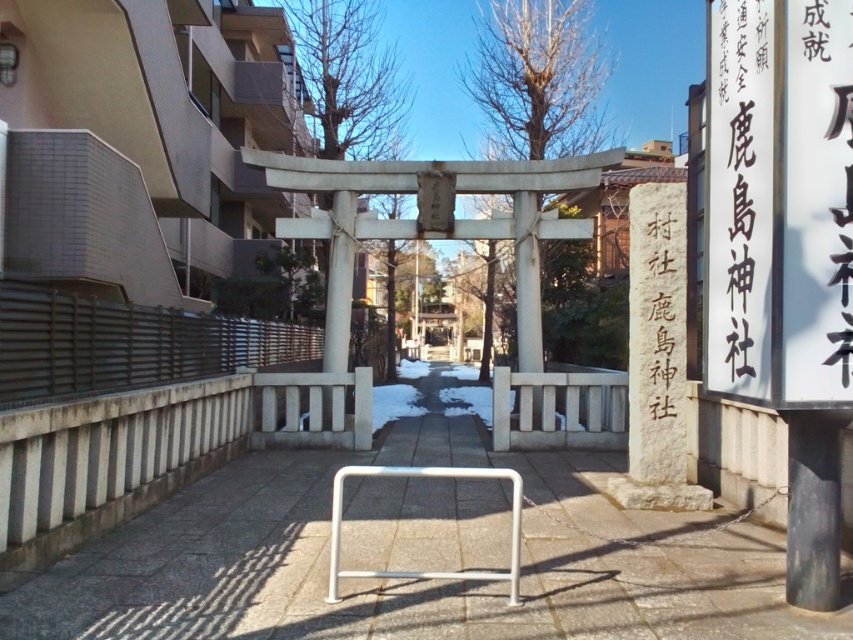
Which is more to the left, black stone sign at center right or white metallic bar at center?

Positioned to the left is white metallic bar at center.

In the scene shown: Is black stone sign at center right above white metallic bar at center?

Yes.

Locate an element on the screen. black stone sign at center right is located at coordinates (662, 316).

Which is below, gray concrete pavement at center or white metallic bar at center?

white metallic bar at center is below.

Which of these two, gray concrete pavement at center or white metallic bar at center, stands taller?

With more height is white metallic bar at center.

Is point (637, 572) positioned behind point (363, 576)?

Yes, point (637, 572) is behind point (363, 576).

Locate an element on the screen. The width and height of the screenshot is (853, 640). gray concrete pavement at center is located at coordinates (407, 580).

Measure the distance between gray concrete pavement at center and black stone sign at center right.

A distance of 3.38 meters exists between gray concrete pavement at center and black stone sign at center right.

Does point (563, 616) lie in front of point (640, 344)?

Yes, point (563, 616) is closer to viewer.

Find the location of a particular element. gray concrete pavement at center is located at coordinates (407, 580).